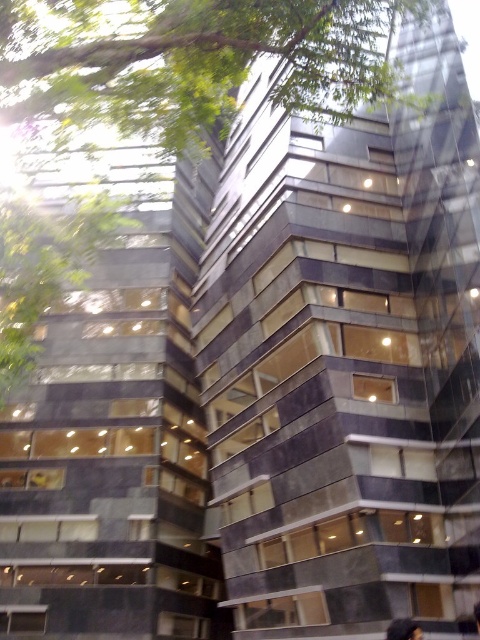
Question: Which point is farther to the camera?

Choices:
 (A) green leafy tree at upper left
 (B) dark hair at upper center

Answer: (B)

Question: Is green leafy tree at upper left wider than dark hair at upper center?

Choices:
 (A) yes
 (B) no

Answer: (A)

Question: From the image, what is the correct spatial relationship of green leafy tree at upper left in relation to dark hair at upper center?

Choices:
 (A) above
 (B) below

Answer: (A)

Question: Is green leafy tree at upper left below dark hair at upper center?

Choices:
 (A) no
 (B) yes

Answer: (A)

Question: Which point is farther to the camera?

Choices:
 (A) green leafy tree at upper left
 (B) dark hair at upper center

Answer: (B)

Question: Among these points, which one is nearest to the camera?

Choices:
 (A) (403, 618)
 (B) (28, 221)

Answer: (A)